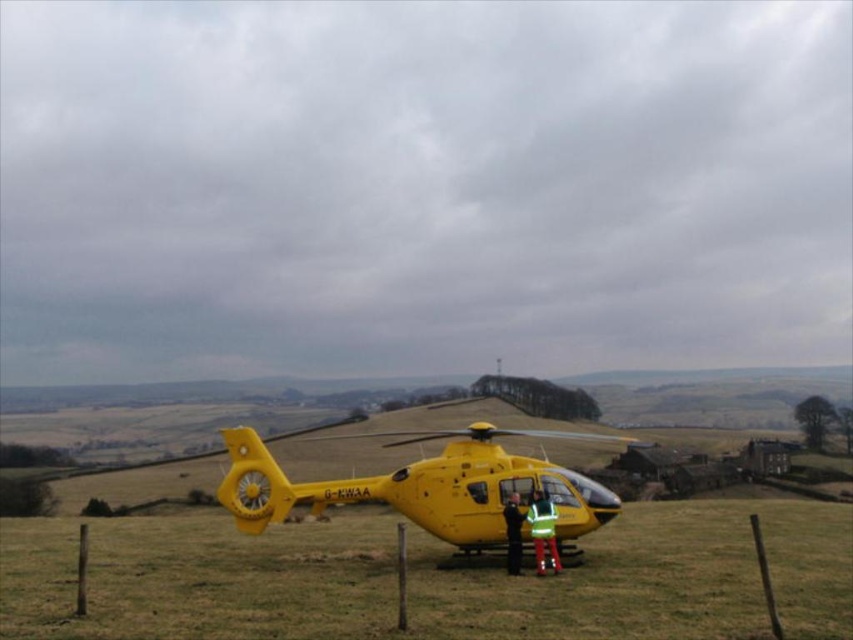
Which is more to the right, yellow matte helicopter at center or reflective yellow jacket at center?

Positioned to the right is reflective yellow jacket at center.

Who is positioned more to the left, yellow matte helicopter at center or reflective yellow jacket at center?

Positioned to the left is yellow matte helicopter at center.

At what (x,y) coordinates should I click in order to perform the action: click on yellow matte helicopter at center. Please return your answer as a coordinate pair (x, y). This screenshot has height=640, width=853. Looking at the image, I should click on (430, 579).

Which is below, matte yellow helicopter at center or reflective green vest at center?

matte yellow helicopter at center is below.

Is matte yellow helicopter at center thinner than reflective green vest at center?

No.

Between point (410, 515) and point (520, 525), which one is positioned behind?

The point (410, 515) is behind.

Find the location of a particular element. The height and width of the screenshot is (640, 853). matte yellow helicopter at center is located at coordinates (426, 486).

Who is taller, yellow matte helicopter at center or matte yellow helicopter at center?

matte yellow helicopter at center is taller.

The image size is (853, 640). Describe the element at coordinates (430, 579) in the screenshot. I see `yellow matte helicopter at center` at that location.

Where is `yellow matte helicopter at center`? yellow matte helicopter at center is located at coordinates (430, 579).